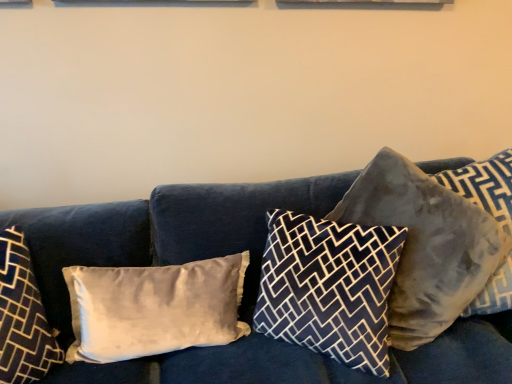
Measure the distance between velvet gray pillow at right, arranged as the second pillow when viewed from the right, and camera.

velvet gray pillow at right, arranged as the second pillow when viewed from the right, is 3.69 feet from camera.

Find the location of a particular element. velvet gray pillow at right, which ranks as the 4th pillow in left-to-right order is located at coordinates (438, 239).

Describe the element at coordinates (329, 287) in the screenshot. I see `dark blue patterned pillow at center, which is the 3th pillow in left-to-right order` at that location.

The image size is (512, 384). Find the location of `velvet blue couch at center`. velvet blue couch at center is located at coordinates (164, 232).

This screenshot has width=512, height=384. Identify the location of studio couch on the right side of velvet white pillow at left, marked as the fifth pillow in a right-to-left arrangement. (164, 232).

From a real-world perspective, is velvet blue couch at center physically below velvet white pillow at left, acting as the first pillow starting from the left?

Correct, in the physical world, velvet blue couch at center is lower than velvet white pillow at left, acting as the first pillow starting from the left.

Is velvet blue couch at center positioned beyond the bounds of velvet white pillow at left, marked as the fifth pillow in a right-to-left arrangement?

Indeed, velvet blue couch at center is completely outside velvet white pillow at left, marked as the fifth pillow in a right-to-left arrangement.

Is point (86, 231) closer to camera compared to point (12, 296)?

No, it is not.

From a real-world perspective, is velvety gray pillow at right, the fifth pillow from the left, beneath velvet gray pillow at right, arranged as the second pillow when viewed from the right?

No, from a real-world perspective, velvety gray pillow at right, the fifth pillow from the left, is not below velvet gray pillow at right, arranged as the second pillow when viewed from the right.

From the velvety gray pillow at right, the fifth pillow from the left, count 2nd pillows backward and point to it. Please provide its 2D coordinates.

[(438, 239)]

Which object is positioned more to the right, velvety gray pillow at right, the fifth pillow from the left, or velvet gray pillow at right, arranged as the second pillow when viewed from the right?

From the viewer's perspective, velvety gray pillow at right, the fifth pillow from the left, appears more on the right side.

Considering the relative positions of velvet gray pillow at right, arranged as the second pillow when viewed from the right, and velvety gray pillow at right, the fifth pillow from the left, in the image provided, is velvet gray pillow at right, arranged as the second pillow when viewed from the right, in front of velvety gray pillow at right, the fifth pillow from the left,?

No, velvet gray pillow at right, arranged as the second pillow when viewed from the right, is behind velvety gray pillow at right, the fifth pillow from the left.

Are velvet gray pillow at right, which ranks as the 4th pillow in left-to-right order, and velvety gray pillow at right, the fifth pillow from the left, far apart?

No, there isn't a large distance between velvet gray pillow at right, which ranks as the 4th pillow in left-to-right order, and velvety gray pillow at right, the fifth pillow from the left.

Which is farther, (391, 164) or (505, 279)?

Positioned behind is point (391, 164).

Between velvet gray pillow at right, arranged as the second pillow when viewed from the right, and velvety gray pillow at right, the fifth pillow from the left, which one has more height?

Standing taller between the two is velvety gray pillow at right, the fifth pillow from the left.

Where is `the 2nd pillow to the right of the dark blue patterned pillow at center, which is the 3th pillow in left-to-right order, starting your count from the anchor`? This screenshot has height=384, width=512. the 2nd pillow to the right of the dark blue patterned pillow at center, which is the 3th pillow in left-to-right order, starting your count from the anchor is located at coordinates (485, 185).

Can you confirm if dark blue patterned pillow at center, which is the 3th pillow from right to left, is shorter than velvety gray pillow at right, the fifth pillow from the left?

Yes, dark blue patterned pillow at center, which is the 3th pillow from right to left, is shorter than velvety gray pillow at right, the fifth pillow from the left.

Is dark blue patterned pillow at center, which is the 3th pillow in left-to-right order, at the left side of velvety gray pillow at right, acting as the first pillow starting from the right?

Indeed, dark blue patterned pillow at center, which is the 3th pillow in left-to-right order, is positioned on the left side of velvety gray pillow at right, acting as the first pillow starting from the right.

Looking at this image, from the image's perspective, is dark blue patterned pillow at center, which is the 3th pillow in left-to-right order, above velvety gray pillow at right, the fifth pillow from the left?

No, from the image's perspective, dark blue patterned pillow at center, which is the 3th pillow in left-to-right order, is not on top of velvety gray pillow at right, the fifth pillow from the left.

Considering the sizes of objects velvet white pillow at left, marked as the fifth pillow in a right-to-left arrangement, and velvet gray pillow at right, arranged as the second pillow when viewed from the right, in the image provided, who is smaller, velvet white pillow at left, marked as the fifth pillow in a right-to-left arrangement, or velvet gray pillow at right, arranged as the second pillow when viewed from the right,?

velvet white pillow at left, marked as the fifth pillow in a right-to-left arrangement, is smaller.

Does velvet white pillow at left, marked as the fifth pillow in a right-to-left arrangement, turn towards velvet gray pillow at right, which ranks as the 4th pillow in left-to-right order?

No, velvet white pillow at left, marked as the fifth pillow in a right-to-left arrangement, is not oriented towards velvet gray pillow at right, which ranks as the 4th pillow in left-to-right order.

Between velvet white pillow at left, acting as the first pillow starting from the left, and velvet gray pillow at right, which ranks as the 4th pillow in left-to-right order, which one has less height?

With less height is velvet white pillow at left, acting as the first pillow starting from the left.

Is point (18, 269) closer or farther from the camera than point (434, 267)?

Point (18, 269) is closer to the camera than point (434, 267).

At what (x,y) coordinates should I click in order to perform the action: click on the 4th pillow to the left of the velvety gray pillow at right, the fifth pillow from the left, counting from the anchor's position. Please return your answer as a coordinate pair (x, y). Looking at the image, I should click on (23, 316).

Is velvet white pillow at left, marked as the fifth pillow in a right-to-left arrangement, wider or thinner than velvety gray pillow at right, acting as the first pillow starting from the right?

In the image, velvet white pillow at left, marked as the fifth pillow in a right-to-left arrangement, appears to be wider than velvety gray pillow at right, acting as the first pillow starting from the right.

In the scene shown: From a real-world perspective, relative to velvety gray pillow at right, acting as the first pillow starting from the right, is velvet white pillow at left, marked as the fifth pillow in a right-to-left arrangement, vertically above or below?

Clearly, from a real-world perspective, velvet white pillow at left, marked as the fifth pillow in a right-to-left arrangement, is below velvety gray pillow at right, acting as the first pillow starting from the right.

Considering the positions of objects velvet white pillow at left, acting as the first pillow starting from the left, and velvety gray pillow at right, acting as the first pillow starting from the right, in the image provided, who is in front, velvet white pillow at left, acting as the first pillow starting from the left, or velvety gray pillow at right, acting as the first pillow starting from the right,?

velvet white pillow at left, acting as the first pillow starting from the left.

Considering the sizes of objects satin beige pillow at left, which appears as the 4th pillow when viewed from the right, and dark blue patterned pillow at center, which is the 3th pillow from right to left, in the image provided, who is smaller, satin beige pillow at left, which appears as the 4th pillow when viewed from the right, or dark blue patterned pillow at center, which is the 3th pillow from right to left,?

satin beige pillow at left, which appears as the 4th pillow when viewed from the right.

From the picture: Considering the sizes of objects satin beige pillow at left, which appears as the 4th pillow when viewed from the right, and dark blue patterned pillow at center, which is the 3th pillow from right to left, in the image provided, who is wider, satin beige pillow at left, which appears as the 4th pillow when viewed from the right, or dark blue patterned pillow at center, which is the 3th pillow from right to left,?

dark blue patterned pillow at center, which is the 3th pillow from right to left, is wider.

Does satin beige pillow at left, which appears as the 4th pillow when viewed from the right, touch dark blue patterned pillow at center, which is the 3th pillow in left-to-right order?

There is a gap between satin beige pillow at left, which appears as the 4th pillow when viewed from the right, and dark blue patterned pillow at center, which is the 3th pillow in left-to-right order.

Locate an element on the screen. The image size is (512, 384). studio couch lying in front of the velvet white pillow at left, marked as the fifth pillow in a right-to-left arrangement is located at coordinates (164, 232).

Locate an element on the screen. Image resolution: width=512 pixels, height=384 pixels. the 1st pillow positioned below the velvety gray pillow at right, the fifth pillow from the left (from a real-world perspective) is located at coordinates (438, 239).

From the image, which object appears to be farther from velvet gray pillow at right, which ranks as the 4th pillow in left-to-right order, satin beige pillow at left, which appears as the 4th pillow when viewed from the right, or velvety gray pillow at right, the fifth pillow from the left?

satin beige pillow at left, which appears as the 4th pillow when viewed from the right, is further to velvet gray pillow at right, which ranks as the 4th pillow in left-to-right order.

Which object lies nearer to the anchor point velvet white pillow at left, acting as the first pillow starting from the left, dark blue patterned pillow at center, which is the 3th pillow in left-to-right order, or velvety gray pillow at right, acting as the first pillow starting from the right?

dark blue patterned pillow at center, which is the 3th pillow in left-to-right order, is positioned closer to the anchor velvet white pillow at left, acting as the first pillow starting from the left.

Considering their positions, is satin beige pillow at left, which appears as the 4th pillow when viewed from the right, positioned further to velvet white pillow at left, marked as the fifth pillow in a right-to-left arrangement, than velvet gray pillow at right, arranged as the second pillow when viewed from the right?

velvet gray pillow at right, arranged as the second pillow when viewed from the right, is positioned further to the anchor velvet white pillow at left, marked as the fifth pillow in a right-to-left arrangement.

Estimate the real-world distances between objects in this image. Which object is closer to dark blue patterned pillow at center, which is the 3th pillow from right to left, velvet white pillow at left, acting as the first pillow starting from the left, or satin beige pillow at left, which appears as the 4th pillow when viewed from the right?

The object closer to dark blue patterned pillow at center, which is the 3th pillow from right to left, is satin beige pillow at left, which appears as the 4th pillow when viewed from the right.

Which object lies further to the anchor point velvet white pillow at left, marked as the fifth pillow in a right-to-left arrangement, velvet gray pillow at right, which ranks as the 4th pillow in left-to-right order, or satin beige pillow at left, which is the 2th pillow from left to right?

The object further to velvet white pillow at left, marked as the fifth pillow in a right-to-left arrangement, is velvet gray pillow at right, which ranks as the 4th pillow in left-to-right order.

Estimate the real-world distances between objects in this image. Which object is closer to velvet blue couch at center, velvet gray pillow at right, which ranks as the 4th pillow in left-to-right order, or satin beige pillow at left, which appears as the 4th pillow when viewed from the right?

satin beige pillow at left, which appears as the 4th pillow when viewed from the right, lies closer to velvet blue couch at center than the other object.

Consider the image. Considering their positions, is velvet white pillow at left, acting as the first pillow starting from the left, positioned further to velvet gray pillow at right, which ranks as the 4th pillow in left-to-right order, than dark blue patterned pillow at center, which is the 3th pillow from right to left?

velvet white pillow at left, acting as the first pillow starting from the left, is positioned further to the anchor velvet gray pillow at right, which ranks as the 4th pillow in left-to-right order.

From the picture: When comparing their distances from velvet gray pillow at right, which ranks as the 4th pillow in left-to-right order, does satin beige pillow at left, which appears as the 4th pillow when viewed from the right, or velvet white pillow at left, acting as the first pillow starting from the left, seem further?

Based on the image, velvet white pillow at left, acting as the first pillow starting from the left, appears to be further to velvet gray pillow at right, which ranks as the 4th pillow in left-to-right order.

Locate an element on the screen. The width and height of the screenshot is (512, 384). studio couch between velvet white pillow at left, acting as the first pillow starting from the left, and velvety gray pillow at right, the fifth pillow from the left, in the horizontal direction is located at coordinates (164, 232).

Where is `studio couch situated between velvet white pillow at left, marked as the fifth pillow in a right-to-left arrangement, and velvet gray pillow at right, which ranks as the 4th pillow in left-to-right order, from left to right`? studio couch situated between velvet white pillow at left, marked as the fifth pillow in a right-to-left arrangement, and velvet gray pillow at right, which ranks as the 4th pillow in left-to-right order, from left to right is located at coordinates (164, 232).

Where is `pillow situated between velvet white pillow at left, marked as the fifth pillow in a right-to-left arrangement, and velvet blue couch at center from left to right`? This screenshot has width=512, height=384. pillow situated between velvet white pillow at left, marked as the fifth pillow in a right-to-left arrangement, and velvet blue couch at center from left to right is located at coordinates (154, 308).

The width and height of the screenshot is (512, 384). In order to click on studio couch between velvet white pillow at left, acting as the first pillow starting from the left, and dark blue patterned pillow at center, which is the 3th pillow in left-to-right order in this screenshot , I will do click(164, 232).